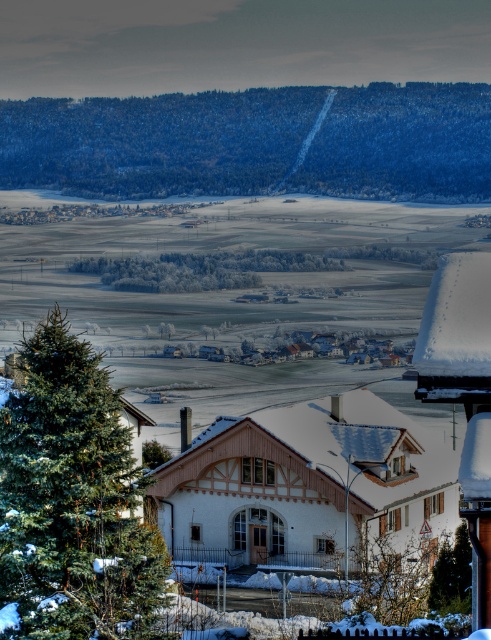
Looking at this image, you are planning to build a small garden between the green textured hillside at upper center and the white wooden house at center. Based on the scene description, which object occupies more horizontal space in the image?

The green textured hillside at upper center might be wider than the white wooden house at center according to the description provided.

You are planning to build a small garden between the green textured hillside at upper center and the white wooden house at center. Considering their heights, which one is more suitable to place taller plants?

The green textured hillside at upper center is much taller than the white wooden house at center, so it would be more suitable to place taller plants there as they can complement the existing height differences in the landscape.